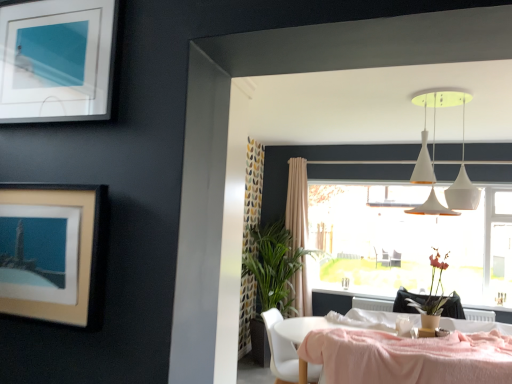
Question: Looking at their shapes, would you say pink fabric-covered table at lower right is wider or thinner than matte silver picture frame at upper left, which ranks as the 1th picture frame in top-to-bottom order?

Choices:
 (A) thin
 (B) wide

Answer: (B)

Question: Is point 318,332 positioned closer to the camera than point 72,44?

Choices:
 (A) closer
 (B) farther

Answer: (B)

Question: Estimate the real-world distances between objects in this image. Which object is farther from the matte brown vase at lower right?

Choices:
 (A) white matte pendant lights at upper center
 (B) transparent glass window at center
 (C) white plastic chair at lower center
 (D) beige matte picture frame at upper left, the first picture frame in the bottom-to-top sequence
 (E) beige fabric curtain at center

Answer: (D)

Question: Based on their relative distances, which object is nearer to the transparent glass window at center?

Choices:
 (A) matte brown vase at lower right
 (B) beige fabric curtain at center
 (C) white plastic chair at lower center
 (D) pink fabric-covered table at lower right
 (E) white matte pendant lights at upper center

Answer: (E)